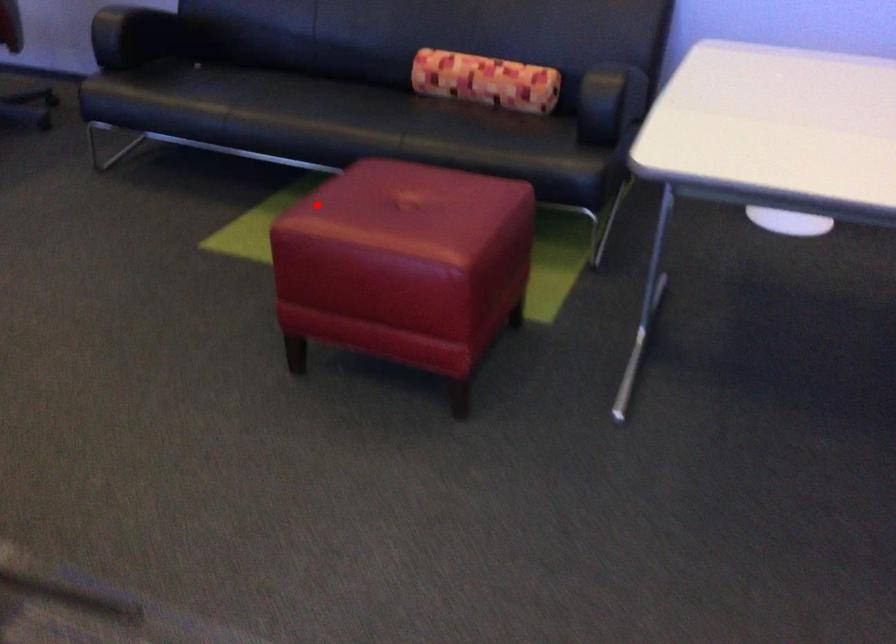
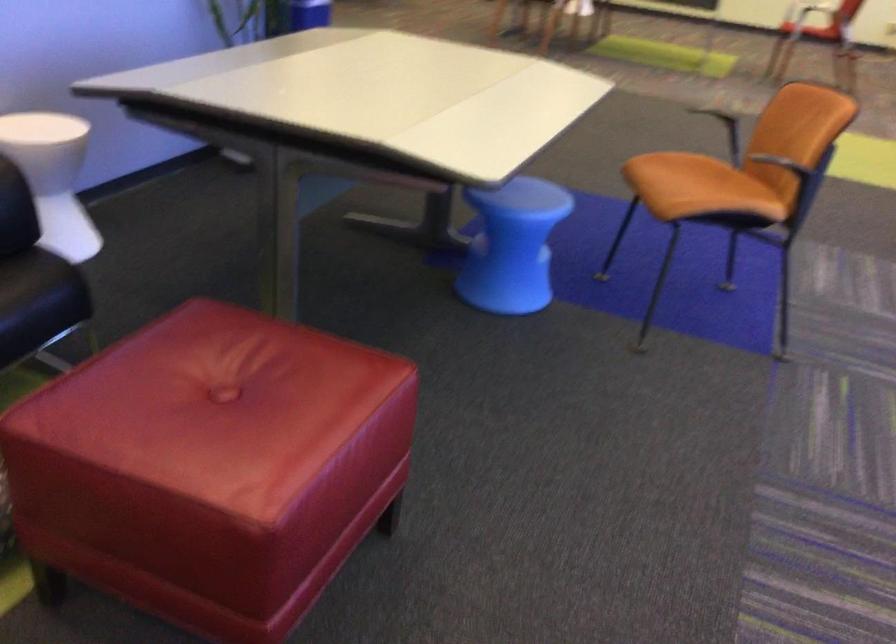
Question: I am providing you with two images of the same scene from different viewpoints. A red point is marked on the first image. At the location where the point appears in image 1, is it still visible in image 2?

Choices:
 (A) Yes
 (B) No

Answer: (A)